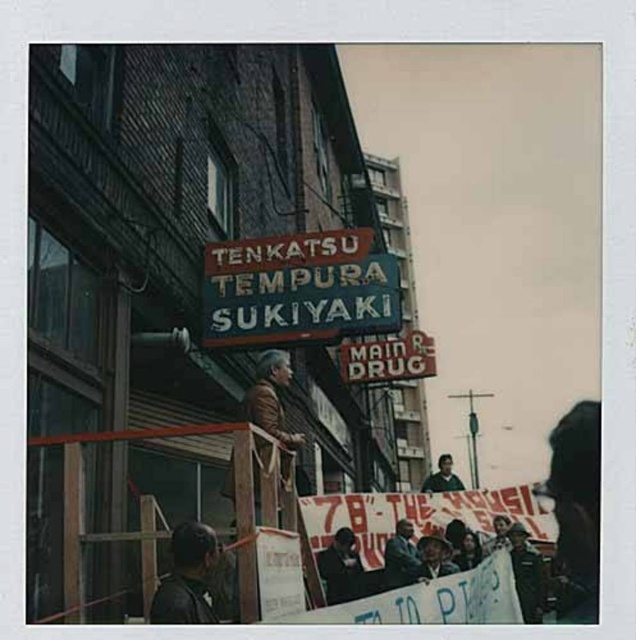
Question: Observing the image, what is the correct spatial positioning of dark brown leather jacket at lower left in reference to dark gray jacket at center?

Choices:
 (A) left
 (B) right

Answer: (A)

Question: Which object is closer to the camera taking this photo?

Choices:
 (A) dark gray jacket at center
 (B) dark green uniform at center
 (C) dark green jacket at center
 (D) metallic signboard at center

Answer: (D)

Question: Can you confirm if dark gray jacket at center is positioned to the left of dark green jacket at center?

Choices:
 (A) yes
 (B) no

Answer: (A)

Question: Which of the following is the farthest from the observer?

Choices:
 (A) smooth black shirt at center
 (B) dark brown leather jacket at lower left
 (C) dark green jacket at center
 (D) dark green uniform at center

Answer: (A)

Question: Which of the following is the closest to the observer?

Choices:
 (A) dark green jacket at center
 (B) dark brown leather jacket at lower left

Answer: (B)

Question: In this image, where is dark brown leather jacket at lower left located relative to smooth black shirt at center?

Choices:
 (A) left
 (B) right

Answer: (A)